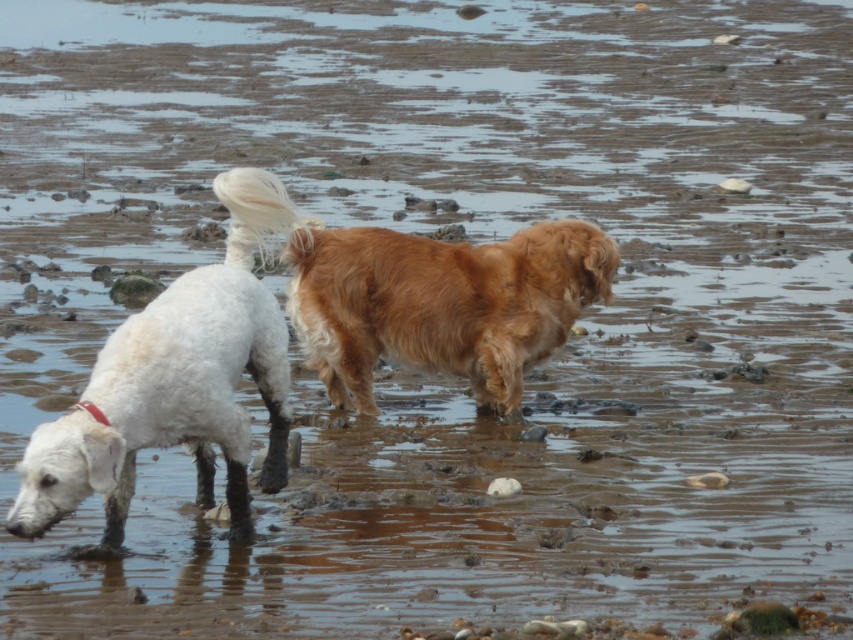
Question: Among these objects, which one is farthest from the camera?

Choices:
 (A) white fluffy dog at left
 (B) golden fur dog at center

Answer: (B)

Question: Is golden fur dog at center in front of white fluffy dog at left?

Choices:
 (A) yes
 (B) no

Answer: (B)

Question: Does golden fur dog at center appear under white fluffy dog at left?

Choices:
 (A) no
 (B) yes

Answer: (A)

Question: Which of the following is the farthest from the observer?

Choices:
 (A) golden fur dog at center
 (B) white fluffy dog at left

Answer: (A)

Question: In this image, where is golden fur dog at center located relative to white fluffy dog at left?

Choices:
 (A) above
 (B) below

Answer: (A)